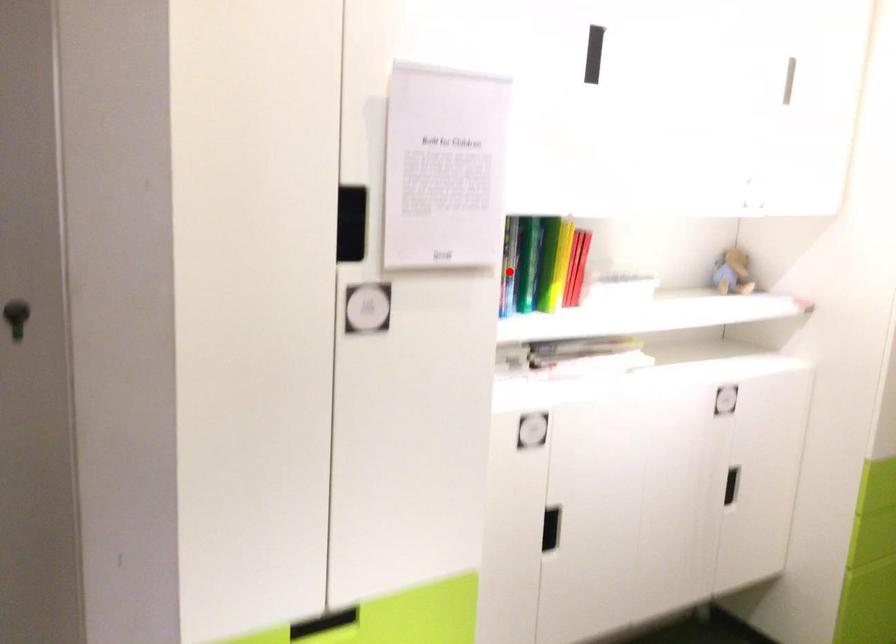
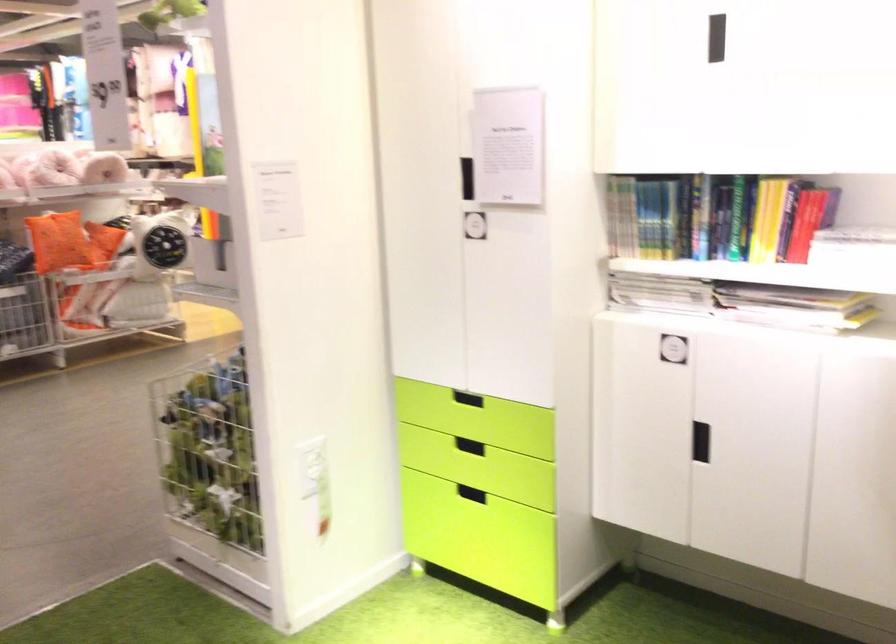
The point at the highlighted location is marked in the first image. Where is the corresponding point in the second image?

(717, 216)